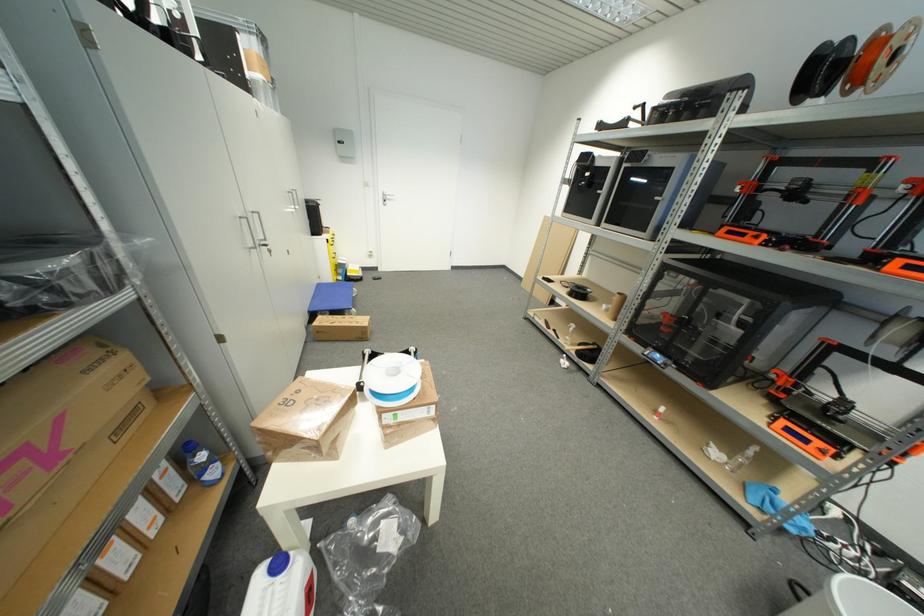
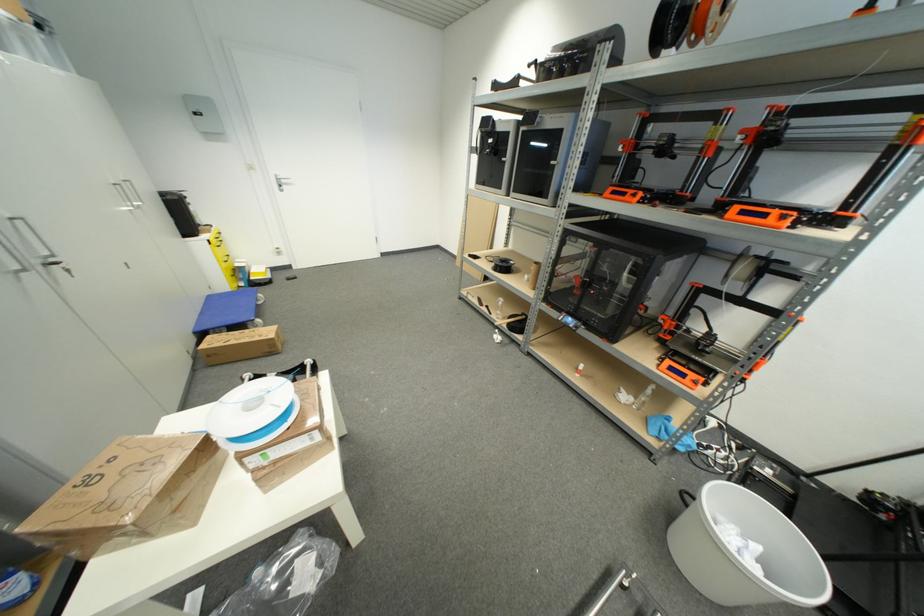
In the second image, find the point that corresponds to point (386, 204) in the first image.

(281, 188)